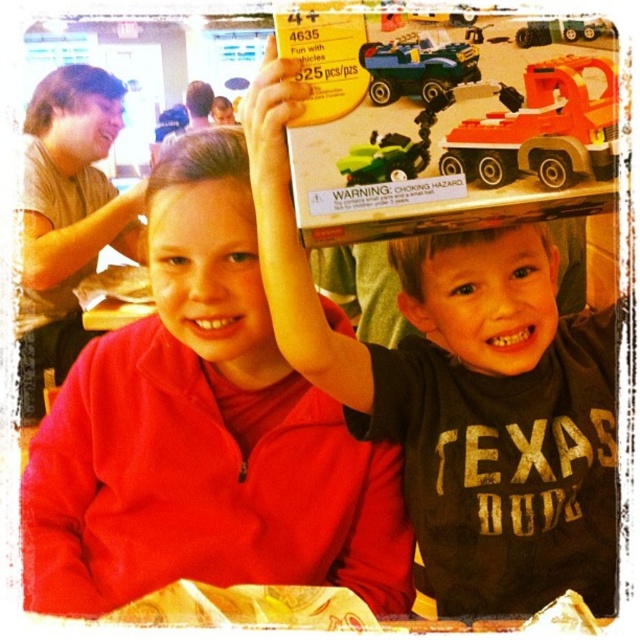
Question: Estimate the real-world distances between objects in this image. Which object is farther from the green plastic car at upper center?

Choices:
 (A) green plastic toy car at upper center
 (B) black matte head at center
 (C) green plastic tractor at upper center

Answer: (B)

Question: Is matte red jacket at center thinner than black matte toy box at upper center?

Choices:
 (A) yes
 (B) no

Answer: (B)

Question: Which point is farther to the camera?

Choices:
 (A) (186, 108)
 (B) (218, 120)

Answer: (A)

Question: In this image, where is green plastic tractor at upper center located relative to matte plastic head at upper center?

Choices:
 (A) left
 (B) right

Answer: (B)

Question: Which of the following is the closest to the observer?

Choices:
 (A) green plastic car at upper center
 (B) green plastic toy car at upper center

Answer: (B)

Question: Is translucent orange plastic truck at upper center below smooth plastic head at upper center?

Choices:
 (A) no
 (B) yes

Answer: (B)